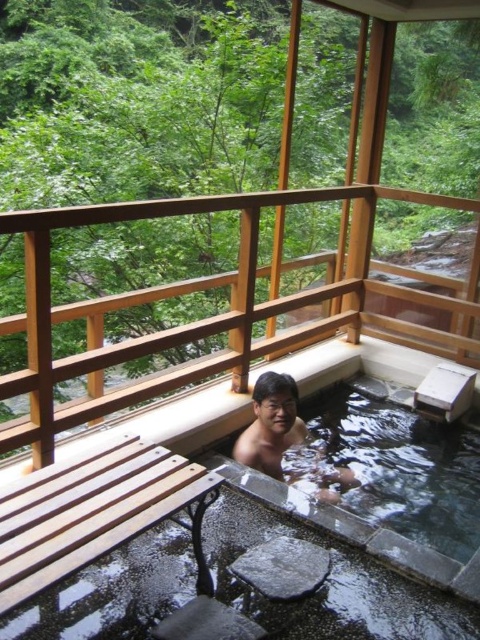
Question: Which of the following is the closest to the observer?

Choices:
 (A) (434, 460)
 (B) (86, 356)
 (C) (330, 476)

Answer: (B)

Question: Can you confirm if clear water at tub center is smaller than smooth skin man at center?

Choices:
 (A) no
 (B) yes

Answer: (A)

Question: Is clear water at tub center positioned before smooth skin man at center?

Choices:
 (A) yes
 (B) no

Answer: (A)

Question: Which object is positioned farthest from the clear water at tub center?

Choices:
 (A) smooth skin man at center
 (B) wooden at center

Answer: (B)

Question: Can you confirm if clear water at tub center is smaller than smooth skin man at center?

Choices:
 (A) no
 (B) yes

Answer: (A)

Question: Which of the following is the closest to the observer?

Choices:
 (A) wooden at center
 (B) clear water at tub center

Answer: (A)